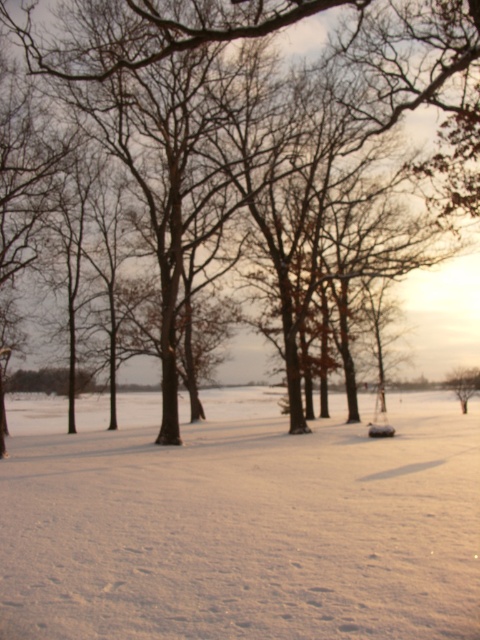
Between white powdery snow at center and brown bark tree at center, which one is positioned lower?

white powdery snow at center

Does point (165, 547) come closer to viewer compared to point (11, 28)?

That is True.

Where is `white powdery snow at center`? This screenshot has height=640, width=480. white powdery snow at center is located at coordinates (240, 520).